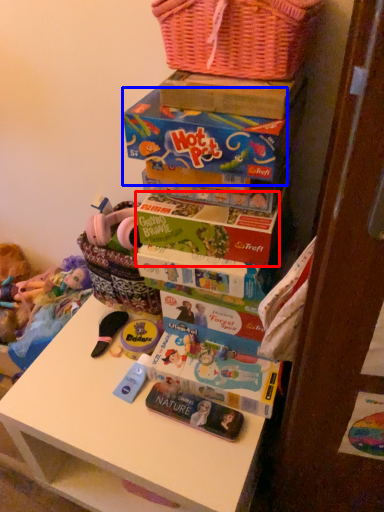
Question: Which of the following is the farthest to the observer, book (highlighted by a red box) or storage box (highlighted by a blue box)?

Choices:
 (A) book
 (B) storage box

Answer: (A)